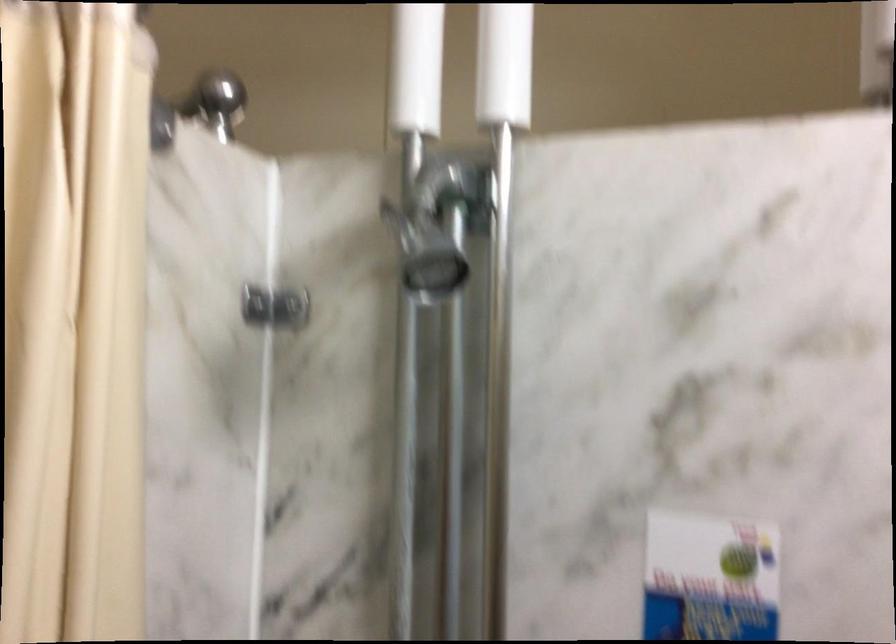
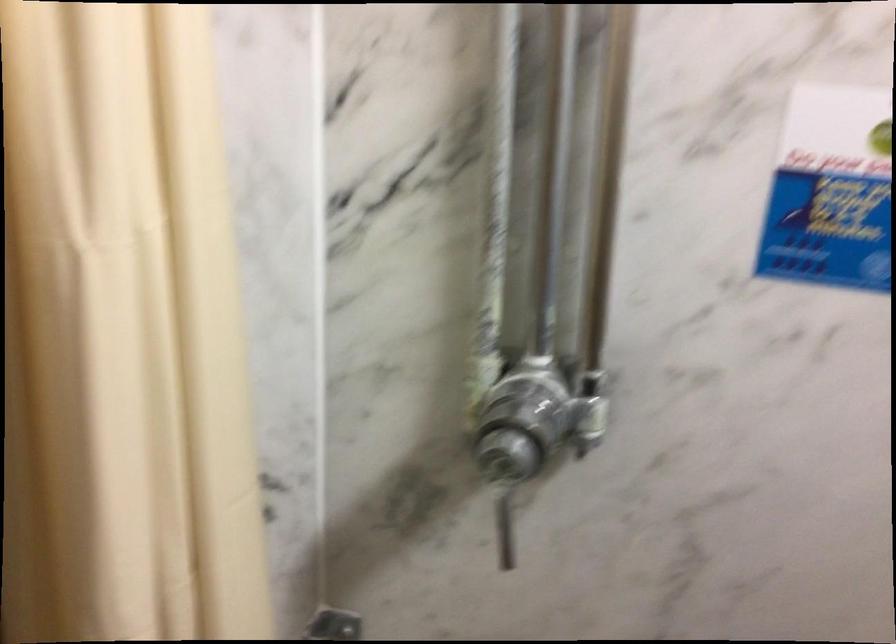
Question: Which direction would the cameraman need to move to produce the second image? Reply with the corresponding letter.

Choices:
 (A) Left
 (B) Right
 (C) Forward
 (D) Backward

Answer: (D)